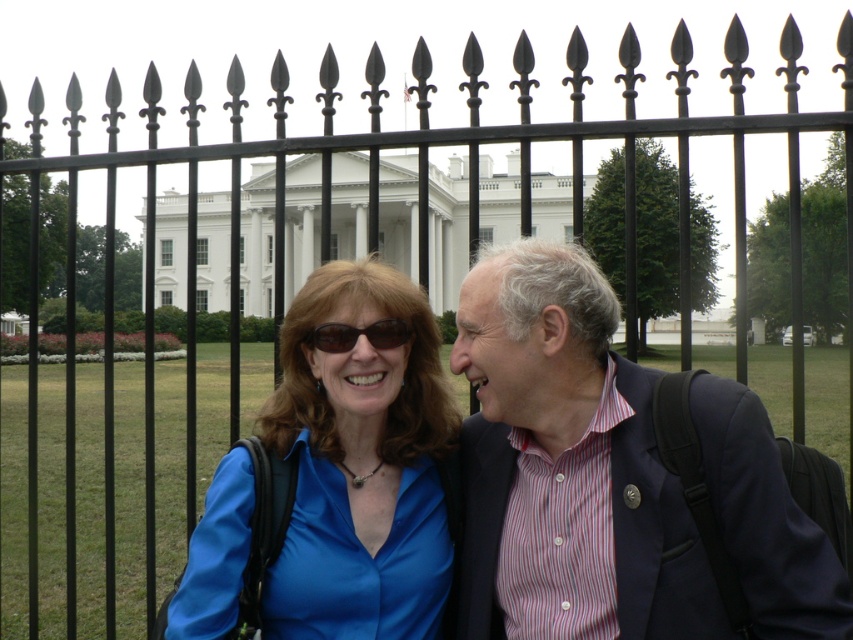
Between striped cotton shirt at center and blue satin blouse at center, which one is positioned higher?

Positioned higher is striped cotton shirt at center.

This screenshot has height=640, width=853. Describe the element at coordinates (566, 465) in the screenshot. I see `striped cotton shirt at center` at that location.

Is point (593, 321) farther from viewer compared to point (405, 342)?

No, it is in front of (405, 342).

Where is `striped cotton shirt at center`? striped cotton shirt at center is located at coordinates (566, 465).

Does striped cotton shirt at center have a greater width compared to matte black sunglasses at center?

Yes, striped cotton shirt at center is wider than matte black sunglasses at center.

The width and height of the screenshot is (853, 640). What do you see at coordinates (566, 465) in the screenshot? I see `striped cotton shirt at center` at bounding box center [566, 465].

What are the coordinates of `striped cotton shirt at center` in the screenshot? It's located at (566, 465).

Is point (407, 538) closer to viewer compared to point (338, 324)?

That is False.

From the picture: Is blue satin blouse at center positioned in front of matte black sunglasses at center?

Yes, it is in front of matte black sunglasses at center.

Is point (297, 346) positioned behind point (323, 344)?

Yes, point (297, 346) is farther from viewer.

This screenshot has width=853, height=640. In order to click on blue satin blouse at center in this screenshot , I will do `click(360, 465)`.